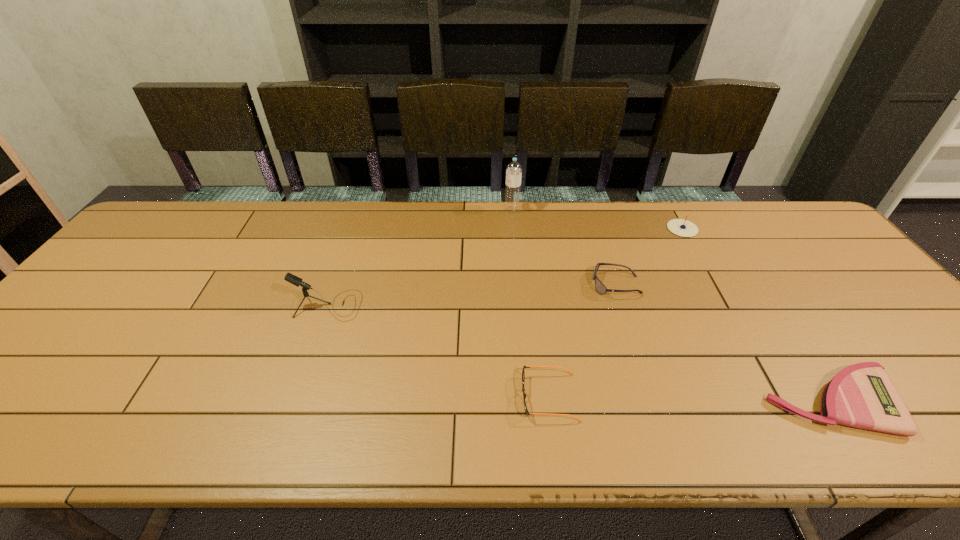
The height and width of the screenshot is (540, 960). In order to click on free spot at the near left corner of the desktop in this screenshot , I will do `click(19, 415)`.

Locate an element on the screen. Image resolution: width=960 pixels, height=540 pixels. free space at the far right corner of the desktop is located at coordinates (820, 244).

You are a GUI agent. You are given a task and a screenshot of the screen. Output one action in this format:
    pyautogui.click(x=<x>, y=<y>)
    Task: Click on the blank region between the spectacles and the microphone
    Image resolution: width=960 pixels, height=540 pixels.
    Given the screenshot: What is the action you would take?
    pyautogui.click(x=439, y=351)

Identify the location of vacant area between the spectacles and the microphone. The height and width of the screenshot is (540, 960). (439, 351).

Identify the location of free space between the spectacles and the third tallest object. Image resolution: width=960 pixels, height=540 pixels. (615, 313).

The image size is (960, 540). In order to click on blank region between the compass and the spectacles in this screenshot , I will do `click(615, 313)`.

Find the location of `free space that is in between the wristlet and the spectacles`. free space that is in between the wristlet and the spectacles is located at coordinates (691, 399).

The image size is (960, 540). I want to click on vacant region between the microphone and the wristlet, so click(x=580, y=354).

Locate an element on the screen. This screenshot has width=960, height=540. vacant point located between the farthest object and the fifth shortest object is located at coordinates (420, 258).

Find the location of `free space between the fourth object from left to right and the spectacles`. free space between the fourth object from left to right and the spectacles is located at coordinates (583, 341).